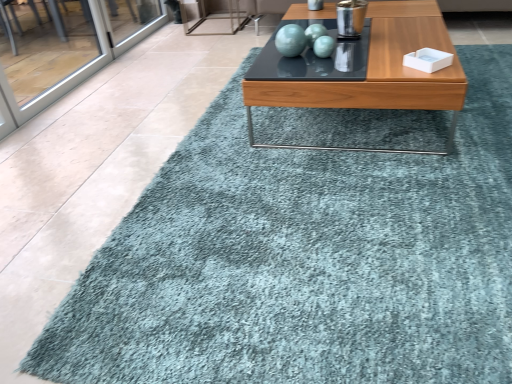
Question: Should I look upward or downward to see matte turquoise sphere at center?

Choices:
 (A) up
 (B) down

Answer: (A)

Question: Is matte turquoise sphere at center at the left side of wooden glossy coffee table at center?

Choices:
 (A) yes
 (B) no

Answer: (A)

Question: From a real-world perspective, is matte turquoise sphere at center on wooden glossy coffee table at center?

Choices:
 (A) no
 (B) yes

Answer: (B)

Question: Considering the relative sizes of matte turquoise sphere at center and wooden glossy coffee table at center in the image provided, is matte turquoise sphere at center wider than wooden glossy coffee table at center?

Choices:
 (A) no
 (B) yes

Answer: (A)

Question: Is matte turquoise sphere at center in contact with wooden glossy coffee table at center?

Choices:
 (A) yes
 (B) no

Answer: (B)

Question: From the image's perspective, is matte turquoise sphere at center located above wooden glossy coffee table at center?

Choices:
 (A) yes
 (B) no

Answer: (A)

Question: Is wooden glossy coffee table at center a part of matte turquoise sphere at center?

Choices:
 (A) yes
 (B) no

Answer: (B)

Question: Could you tell me if wooden glossy coffee table at center is turned towards matte turquoise sphere at center?

Choices:
 (A) no
 (B) yes

Answer: (A)

Question: Would you say wooden glossy coffee table at center is outside matte turquoise sphere at center?

Choices:
 (A) no
 (B) yes

Answer: (B)

Question: Is wooden glossy coffee table at center directly adjacent to matte turquoise sphere at center?

Choices:
 (A) yes
 (B) no

Answer: (B)

Question: From a real-world perspective, is wooden glossy coffee table at center below matte turquoise sphere at center?

Choices:
 (A) yes
 (B) no

Answer: (A)

Question: From a real-world perspective, is wooden glossy coffee table at center positioned over matte turquoise sphere at center based on gravity?

Choices:
 (A) no
 (B) yes

Answer: (A)

Question: Considering the relative sizes of wooden glossy coffee table at center and matte turquoise sphere at center in the image provided, is wooden glossy coffee table at center shorter than matte turquoise sphere at center?

Choices:
 (A) no
 (B) yes

Answer: (A)

Question: In the image, is matte turquoise sphere at center on the left side or the right side of wooden glossy coffee table at center?

Choices:
 (A) right
 (B) left

Answer: (B)